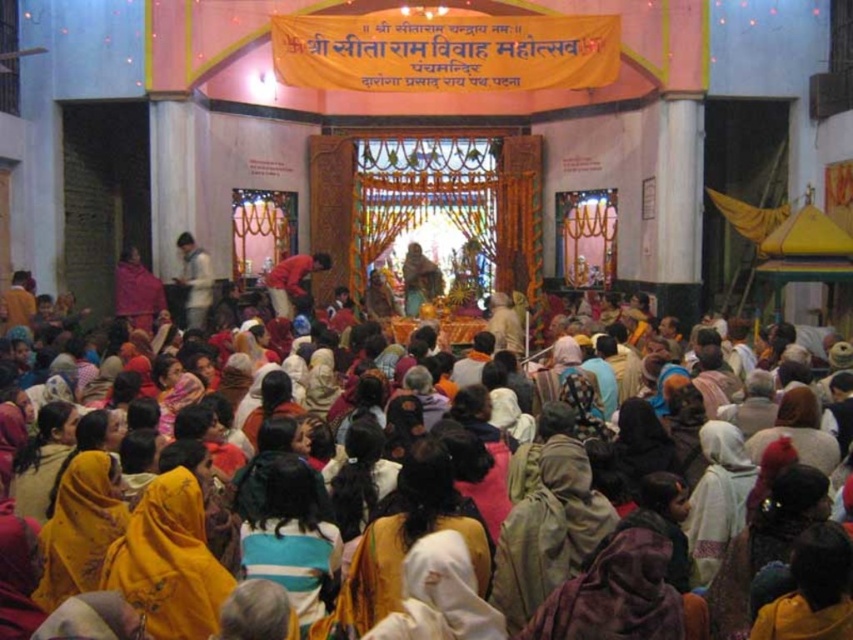
You are a photographer planning to capture a photo of the white matte shirt at center and the red fabric cloth at center in the temple scene. Based on their sizes, which object should you focus on to ensure both are clearly visible in the frame?

The white matte shirt at center occupies less space than the red fabric cloth at center, so focusing on the larger red fabric cloth at center would ensure both objects are visible in the frame.

You are standing at the entrance of the temple and see two points marked in the image. The first point is at coordinate point(679, 412) and the second is at point(189, 250). Which point is closer to you as you face the entrance?

Point(679, 412) is in front of point(189, 250), so the first point is closer to you as you face the entrance.

Based on the photo, you are a photographer standing at the entrance of the temple. You want to take a photo that includes both the yellow fabric at center and the white matte shirt at center. Which object should you focus on first to ensure both are in frame?

The yellow fabric at center is taller than the white matte shirt at center, so you should focus on the yellow fabric at center first to ensure both are in frame.